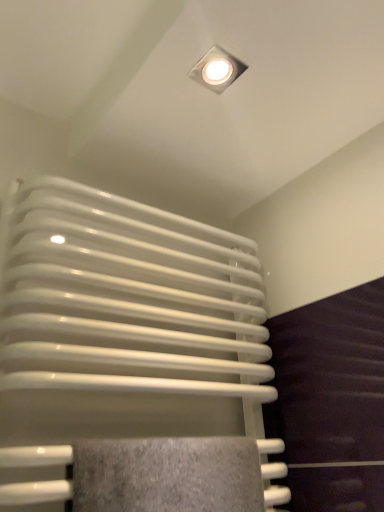
I want to click on white glossy radiator at center, so click(122, 335).

The image size is (384, 512). What do you see at coordinates (122, 335) in the screenshot?
I see `white glossy radiator at center` at bounding box center [122, 335].

What is the approximate height of white glossy square lamp at upper center?

white glossy square lamp at upper center is 0.39 inches in height.

Identify the location of white glossy square lamp at upper center. (217, 70).

What do you see at coordinates (217, 70) in the screenshot? I see `white glossy square lamp at upper center` at bounding box center [217, 70].

This screenshot has height=512, width=384. What are the coordinates of `white glossy radiator at center` in the screenshot? It's located at (122, 335).

Between white glossy radiator at center and white glossy square lamp at upper center, which one appears on the left side from the viewer's perspective?

white glossy radiator at center.

Between white glossy radiator at center and white glossy square lamp at upper center, which one is positioned behind?

white glossy square lamp at upper center is more distant.

Is point (263, 288) positioned before point (213, 59)?

That is False.

In the scene shown: From the image's perspective, which one is positioned higher, white glossy radiator at center or white glossy square lamp at upper center?

white glossy square lamp at upper center, from the image's perspective.

From a real-world perspective, is white glossy radiator at center under white glossy square lamp at upper center?

Yes, from a real-world perspective, white glossy radiator at center is under white glossy square lamp at upper center.

Considering the relative sizes of white glossy radiator at center and white glossy square lamp at upper center in the image provided, is white glossy radiator at center thinner than white glossy square lamp at upper center?

No.

Considering the sizes of white glossy radiator at center and white glossy square lamp at upper center in the image, is white glossy radiator at center taller or shorter than white glossy square lamp at upper center?

In the image, white glossy radiator at center appears to be taller than white glossy square lamp at upper center.

Considering the relative sizes of white glossy radiator at center and white glossy square lamp at upper center in the image provided, is white glossy radiator at center bigger than white glossy square lamp at upper center?

Yes, white glossy radiator at center is bigger than white glossy square lamp at upper center.

Is white glossy radiator at center outside of white glossy square lamp at upper center?

Indeed, white glossy radiator at center is completely outside white glossy square lamp at upper center.

Is white glossy radiator at center beside white glossy square lamp at upper center?

white glossy radiator at center and white glossy square lamp at upper center are not in contact.

Could you tell me if white glossy radiator at center is facing white glossy square lamp at upper center?

No, white glossy radiator at center is not facing towards white glossy square lamp at upper center.

Where is `lamp that is above the white glossy radiator at center (from the image's perspective)`? This screenshot has width=384, height=512. lamp that is above the white glossy radiator at center (from the image's perspective) is located at coordinates (217, 70).

Which object is positioned more to the left, white glossy square lamp at upper center or white glossy radiator at center?

From the viewer's perspective, white glossy radiator at center appears more on the left side.

In the scene shown: Which object is further away from the camera, white glossy square lamp at upper center or white glossy radiator at center?

white glossy square lamp at upper center.

Is point (217, 70) closer to camera compared to point (5, 391)?

That is False.

From the image's perspective, who appears lower, white glossy square lamp at upper center or white glossy radiator at center?

white glossy radiator at center.

From a real-world perspective, which object stands above the other?

From a 3D spatial view, white glossy square lamp at upper center is above.

Does white glossy square lamp at upper center have a lesser width compared to white glossy radiator at center?

Yes.

Can you confirm if white glossy square lamp at upper center is taller than white glossy radiator at center?

No, white glossy square lamp at upper center is not taller than white glossy radiator at center.

Who is bigger, white glossy square lamp at upper center or white glossy radiator at center?

white glossy radiator at center is bigger.

Is white glossy radiator at center completely or partially inside white glossy square lamp at upper center?

That's incorrect, white glossy radiator at center is not inside white glossy square lamp at upper center.

Is white glossy square lamp at upper center with white glossy radiator at center?

They are not placed beside each other.

Is white glossy square lamp at upper center positioned with its back to white glossy radiator at center?

No, white glossy square lamp at upper center's orientation is not away from white glossy radiator at center.

Can you tell me how much white glossy square lamp at upper center and white glossy radiator at center differ in facing direction?

There is a 90-degree angle between the facing directions of white glossy square lamp at upper center and white glossy radiator at center.

Find the location of a particular element. This screenshot has height=512, width=384. lamp behind the white glossy radiator at center is located at coordinates (217, 70).

The image size is (384, 512). Find the location of `radiator below the white glossy square lamp at upper center (from a real-world perspective)`. radiator below the white glossy square lamp at upper center (from a real-world perspective) is located at coordinates (122, 335).

Where is `radiator below the white glossy square lamp at upper center (from the image's perspective)`? The image size is (384, 512). radiator below the white glossy square lamp at upper center (from the image's perspective) is located at coordinates (122, 335).